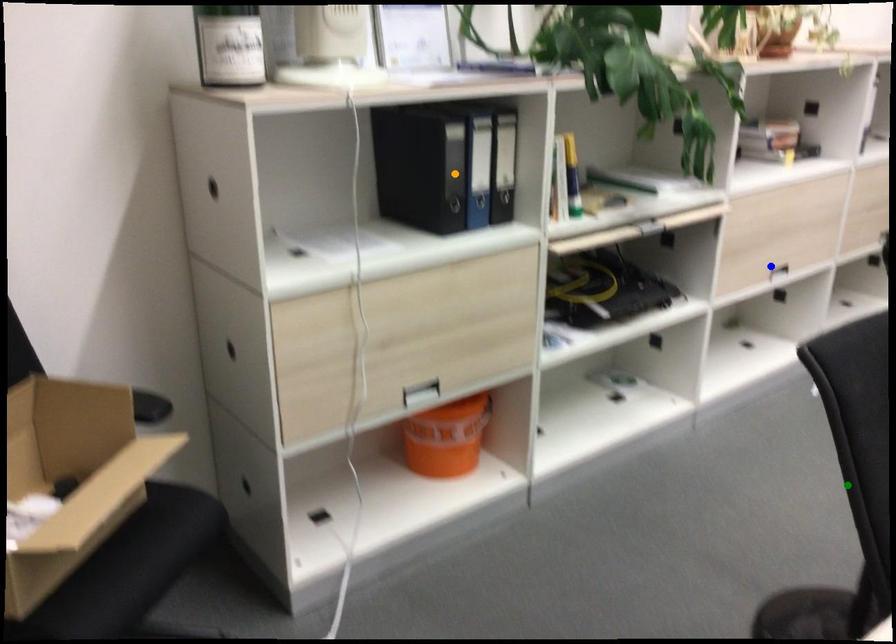
Order these from nearest to farthest:
A) orange point
B) green point
C) blue point

green point → orange point → blue point